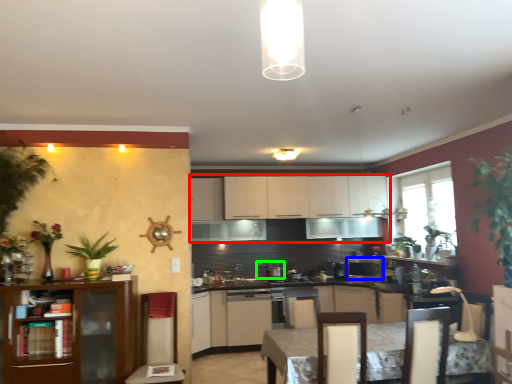
Question: Based on their relative distances, which object is nearer to cabinetry (highlighted by a red box)? Choose from kitchen appliance (highlighted by a blue box) and appliance (highlighted by a green box).

Choices:
 (A) kitchen appliance
 (B) appliance

Answer: (B)